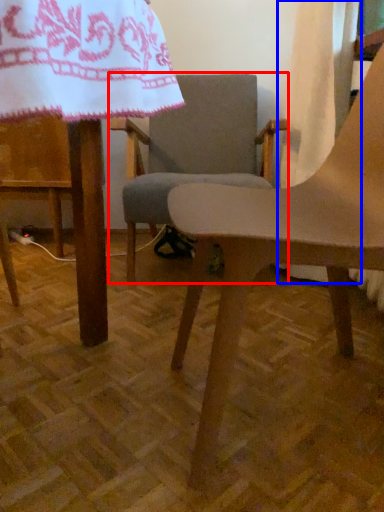
Question: Which object appears closest to the camera in this image, chair (highlighted by a red box) or curtain (highlighted by a blue box)?

Choices:
 (A) chair
 (B) curtain

Answer: (B)